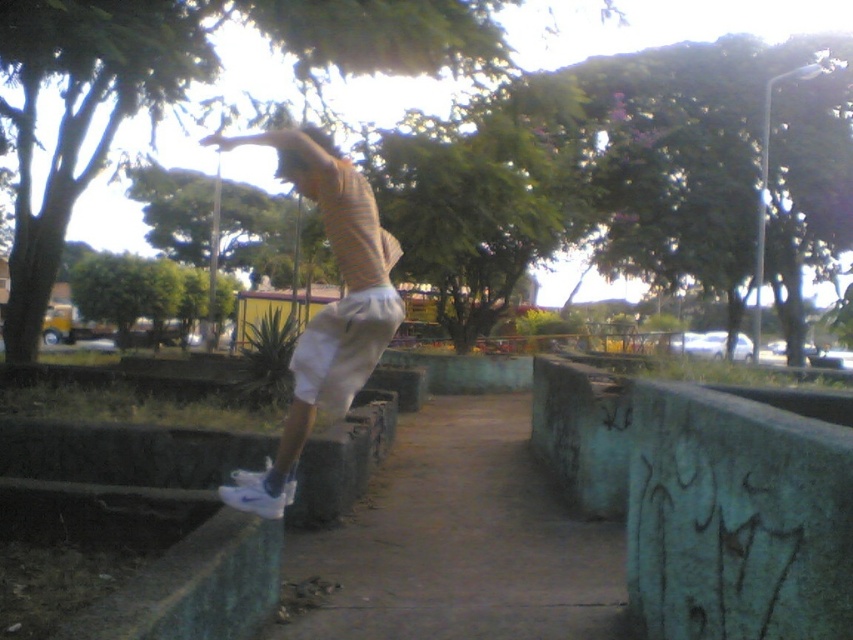
Question: Does green concrete pavement at center appear on the left side of white matte sneakers at center?

Choices:
 (A) yes
 (B) no

Answer: (B)

Question: Is green concrete pavement at center to the left of white matte sneakers at center from the viewer's perspective?

Choices:
 (A) no
 (B) yes

Answer: (A)

Question: Is green concrete pavement at center positioned before white matte sneakers at center?

Choices:
 (A) no
 (B) yes

Answer: (A)

Question: Among these objects, which one is farthest from the camera?

Choices:
 (A) white matte sneakers at center
 (B) green concrete pavement at center

Answer: (B)

Question: Among these objects, which one is farthest from the camera?

Choices:
 (A) white matte sneakers at center
 (B) green concrete pavement at center

Answer: (B)